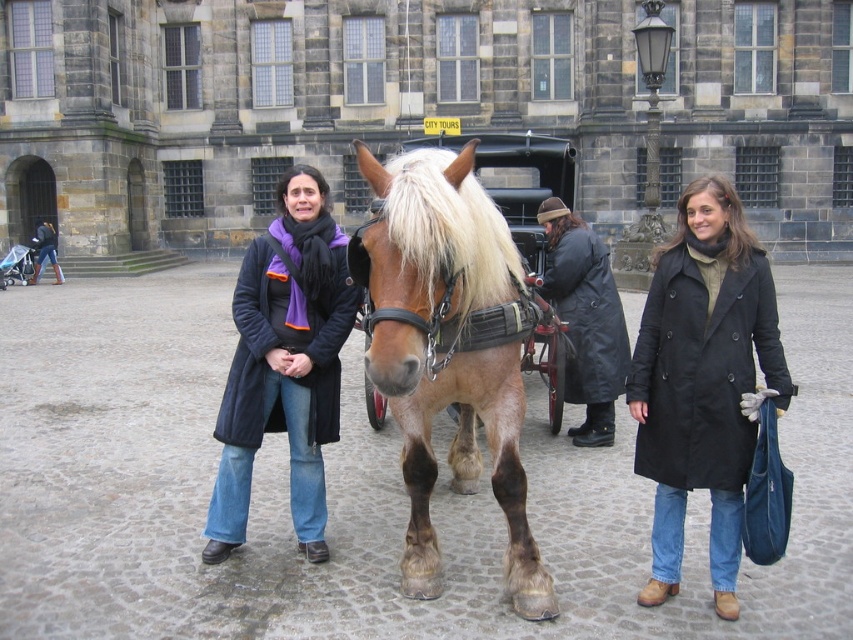
You are a tourist standing at the entrance of the historic stone building. You want to take a photo of the brown glossy horse at center from the front. Is the horse positioned in a way that allows you to capture it fully without any part being cut off by the building?

The brown glossy horse at center is positioned at point 0.524 on the y axis, which is slightly closer to the building than the middle of the image. Since the building is at the back, this position might allow you to capture the horse fully without any part being cut off by the building.

You are standing at the point with coordinates point (x=566, y=264) and want to walk to the entrance of the historic stone building. There is an obstacle at point (x=706, y=253). Will you have to go around the obstacle to reach the entrance?

Point (x=706, y=253) is in front of point (x=566, y=264), so yes, you will have to go around the obstacle at point (x=706, y=253) to reach the entrance.